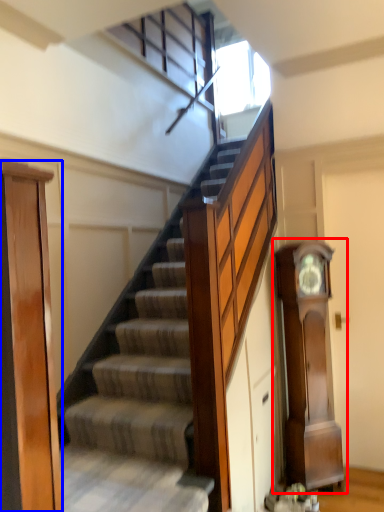
Question: Which point is further to the camera, clock (highlighted by a red box) or door (highlighted by a blue box)?

Choices:
 (A) clock
 (B) door

Answer: (A)